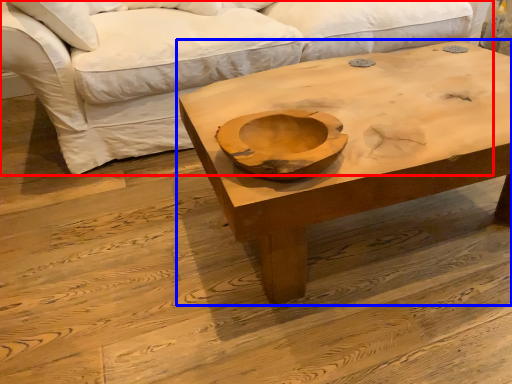
Question: Which of the following is the farthest to the observer, studio couch (highlighted by a red box) or coffee table (highlighted by a blue box)?

Choices:
 (A) studio couch
 (B) coffee table

Answer: (A)